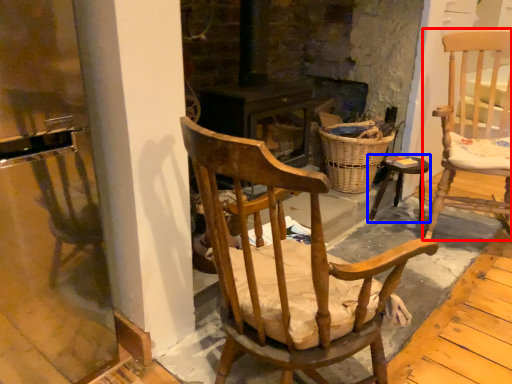
Question: Which object appears closest to the camera in this image, chair (highlighted by a red box) or stool (highlighted by a blue box)?

Choices:
 (A) chair
 (B) stool

Answer: (A)